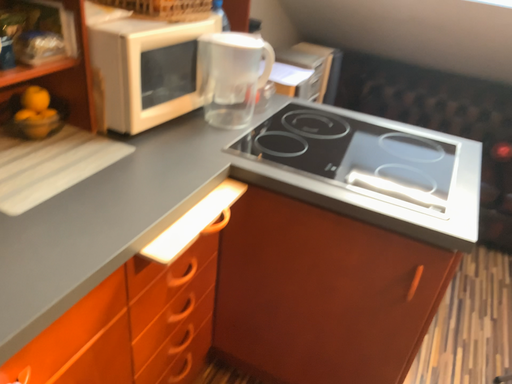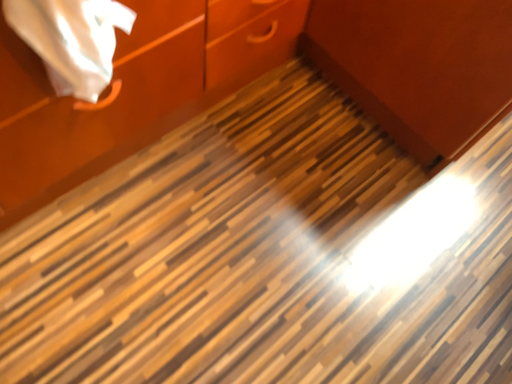
Question: Which way did the camera rotate in the video?

Choices:
 (A) rotated downward
 (B) rotated upward

Answer: (A)